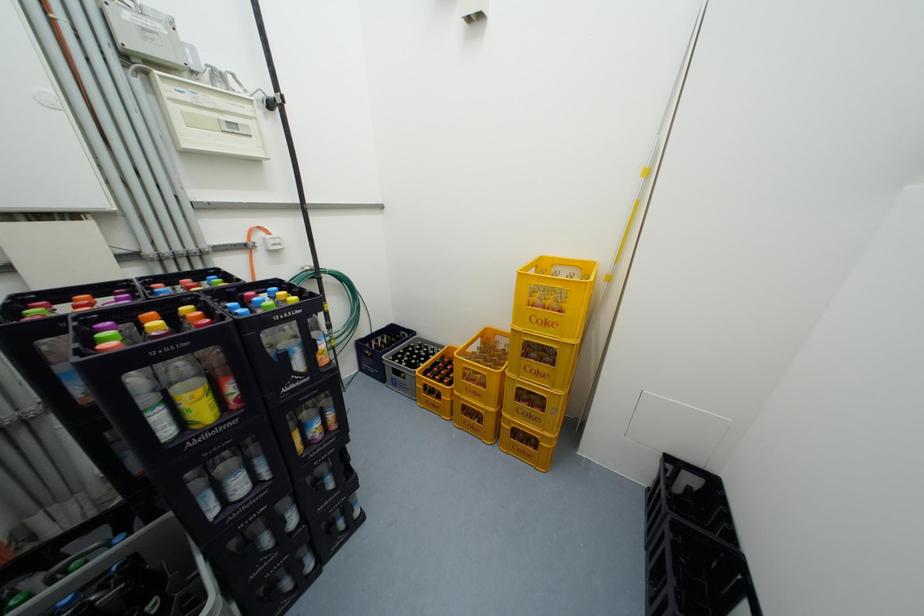
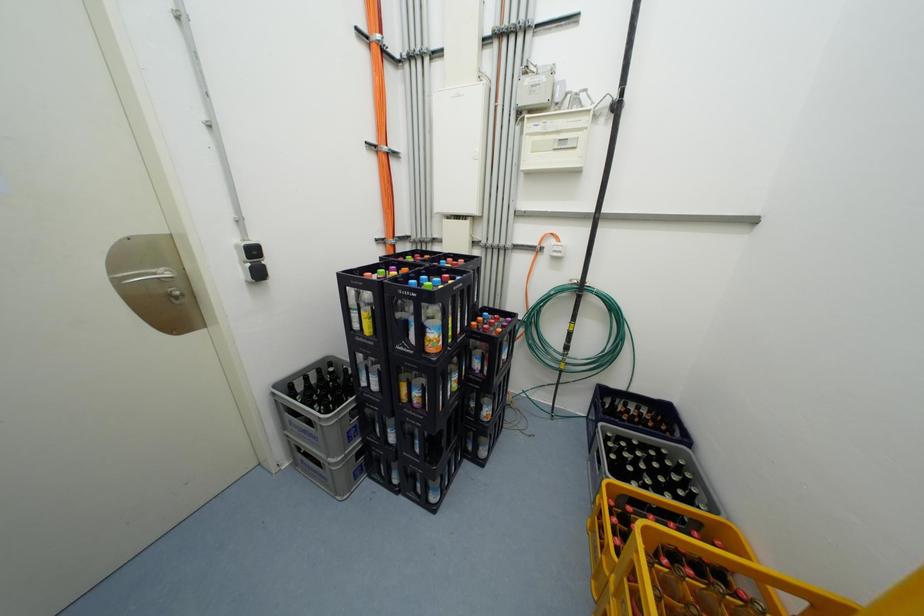
Question: The first image is from the beginning of the video and the second image is from the end. How did the camera likely rotate when shooting the video?

Choices:
 (A) Left
 (B) Right
 (C) Up
 (D) Down

Answer: (A)